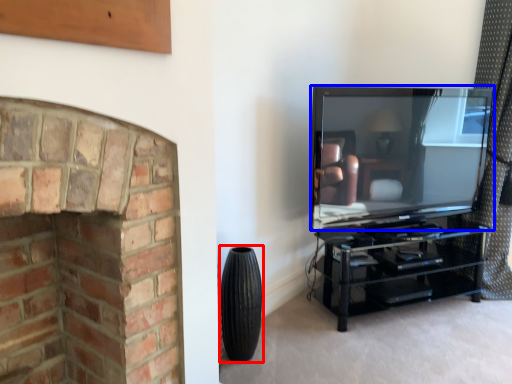
Question: Which point is closer to the camera, tire (highlighted by a red box) or television (highlighted by a blue box)?

Choices:
 (A) tire
 (B) television

Answer: (A)